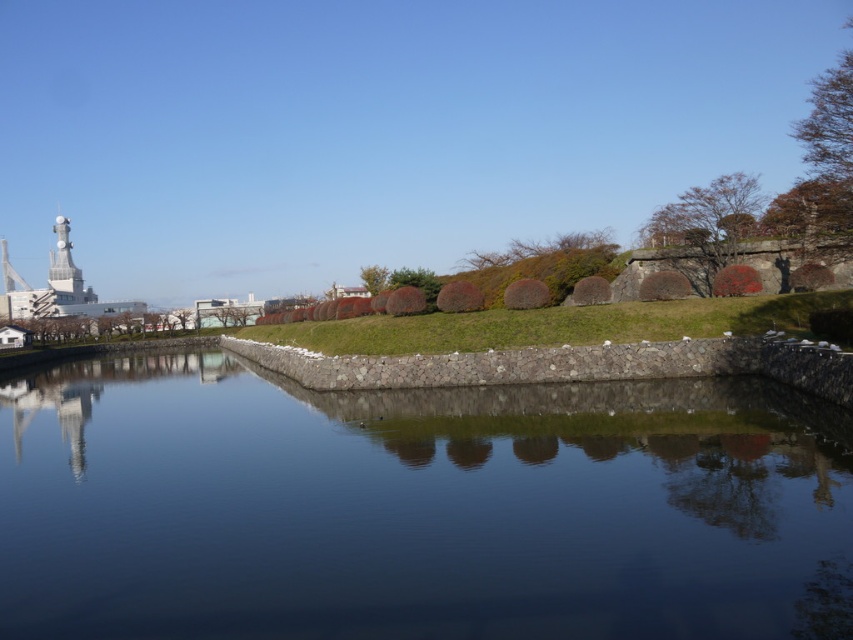
You are a photographer planning to capture the dark stone water at center and the metallic silver tower at upper left in a single frame. Based on their widths, which object should you prioritize framing first to ensure both fit in the shot?

The dark stone water at center has a lesser width compared to the metallic silver tower at upper left, so you should prioritize framing the metallic silver tower at upper left first since it is wider and requires more space in the composition.

You are a photographer planning to capture the dark stone water at center and the metallic silver tower at upper left in a single frame. Based on their heights, which object will appear taller in the photograph?

The metallic silver tower at upper left will appear taller in the photograph because it is taller than the dark stone water at center.

You are a drone operator planning to fly a drone from the dark stone water at center to the metallic silver tower at upper left. The drone has a maximum flight range of 1000 feet. Based on the scene, will the drone be able to reach the tower without needing to recharge?

The distance between the dark stone water at center and the metallic silver tower at upper left is 913.73 feet, which is within the drone operator drone has a maximum flight range of 1000 feet. Therefore, the drone can reach the metallic silver tower at upper left without needing to recharge.